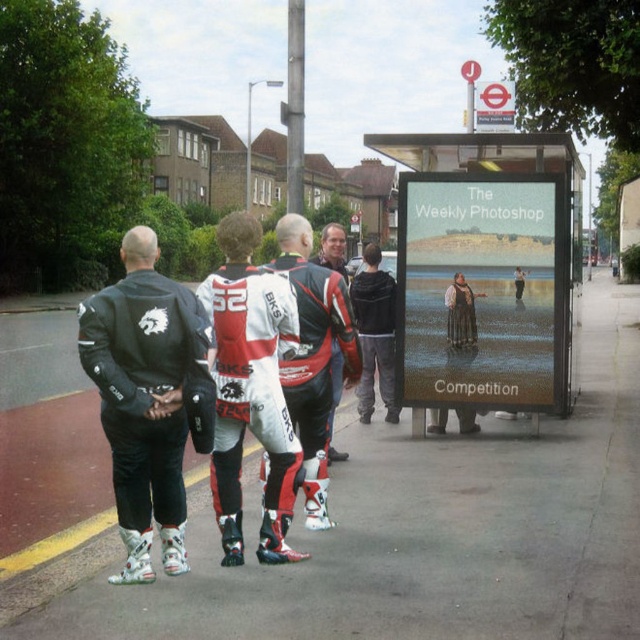
Between smooth asphalt road at center and matte glass signboard at center, which one is positioned higher?

matte glass signboard at center is higher up.

What do you see at coordinates (413, 534) in the screenshot? I see `smooth asphalt road at center` at bounding box center [413, 534].

What do you see at coordinates (413, 534) in the screenshot? I see `smooth asphalt road at center` at bounding box center [413, 534].

The image size is (640, 640). Identify the location of smooth asphalt road at center. (413, 534).

Is matte black jacket at center wider than matte black dress at center?

Correct, the width of matte black jacket at center exceeds that of matte black dress at center.

This screenshot has width=640, height=640. Describe the element at coordinates (332, 250) in the screenshot. I see `matte black jacket at center` at that location.

Image resolution: width=640 pixels, height=640 pixels. In order to click on matte black jacket at center in this screenshot , I will do `click(332, 250)`.

Does smooth asphalt road at center have a smaller size compared to matte black dress at center?

Incorrect, smooth asphalt road at center is not smaller in size than matte black dress at center.

Can you confirm if smooth asphalt road at center is thinner than matte black dress at center?

No.

Where is `smooth asphalt road at center`? smooth asphalt road at center is located at coordinates (413, 534).